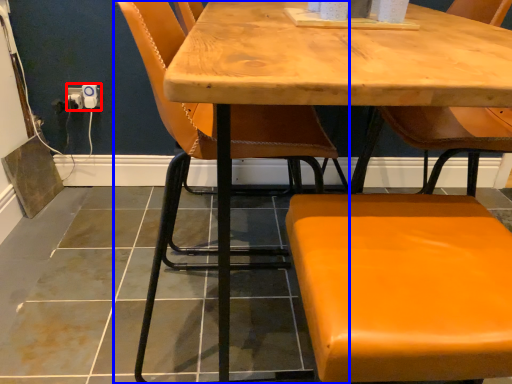
Question: Which of the following is the closest to the observer, electric outlet (highlighted by a red box) or chair (highlighted by a blue box)?

Choices:
 (A) electric outlet
 (B) chair

Answer: (B)